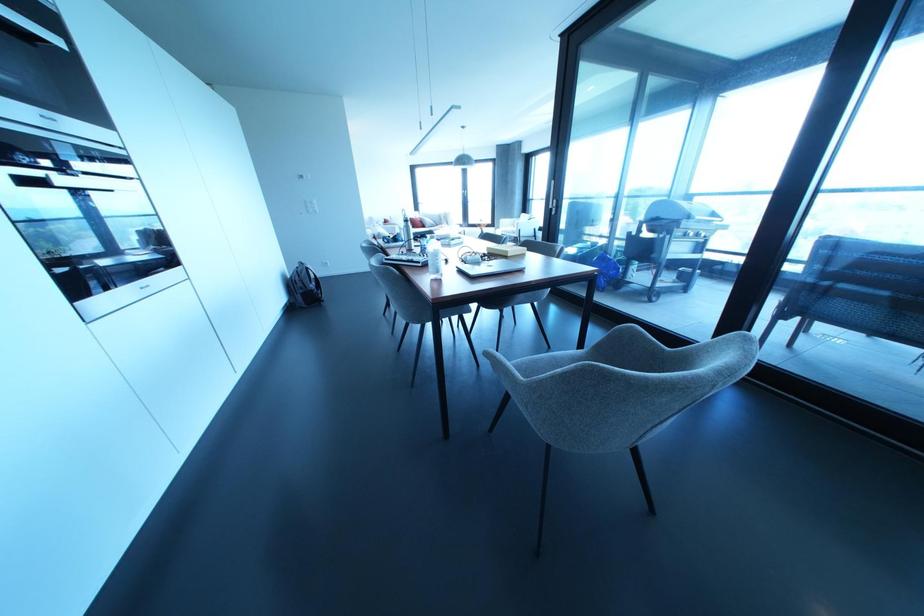
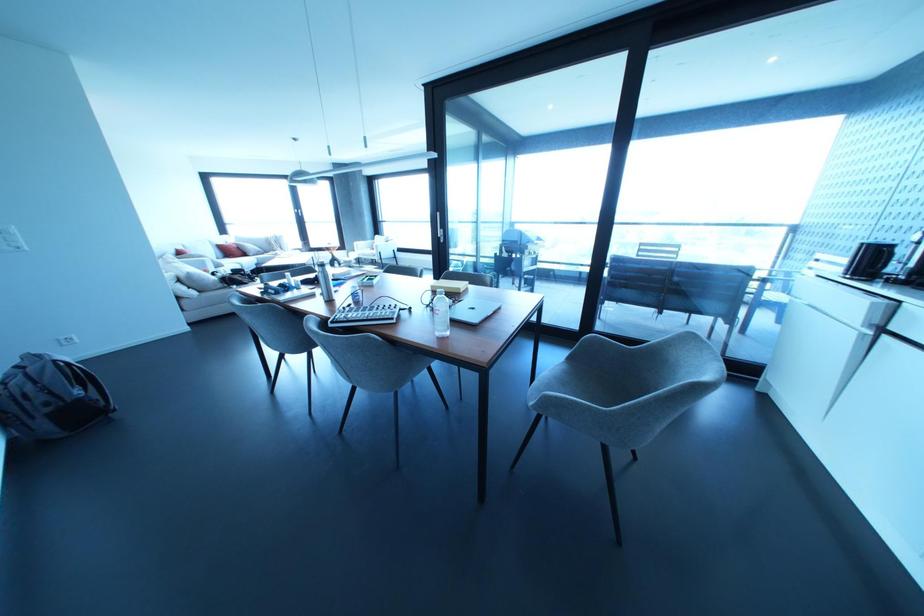
Where in the second image is the point corresponding to pixel 682 350 from the first image?

(646, 346)